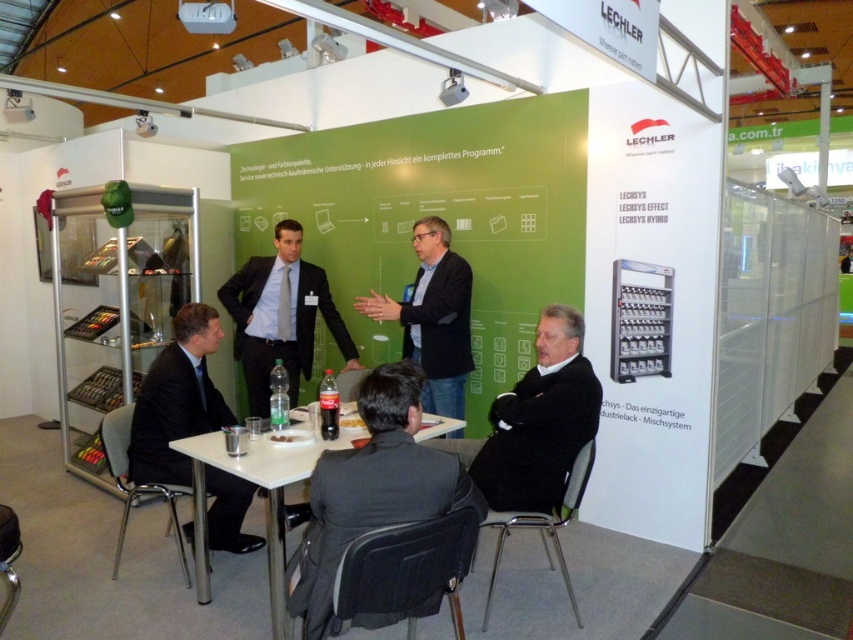
You are standing in front of the LECHLER booth at the exhibition. You see a matte black suit at center and a white plastic table at center. Which object is closer to you?

The matte black suit at center is closer to you than the white plastic table at center.

You are a photographer at the LECHLER booth and need to capture both the black matte suit at lower left and the matte black suit at center in a single shot. Based on their positions, which suit is closer to the camera?

The black matte suit at lower left is closer to the camera because it is positioned below the matte black suit at center, indicating it is lower in the frame and thus nearer to the viewer.